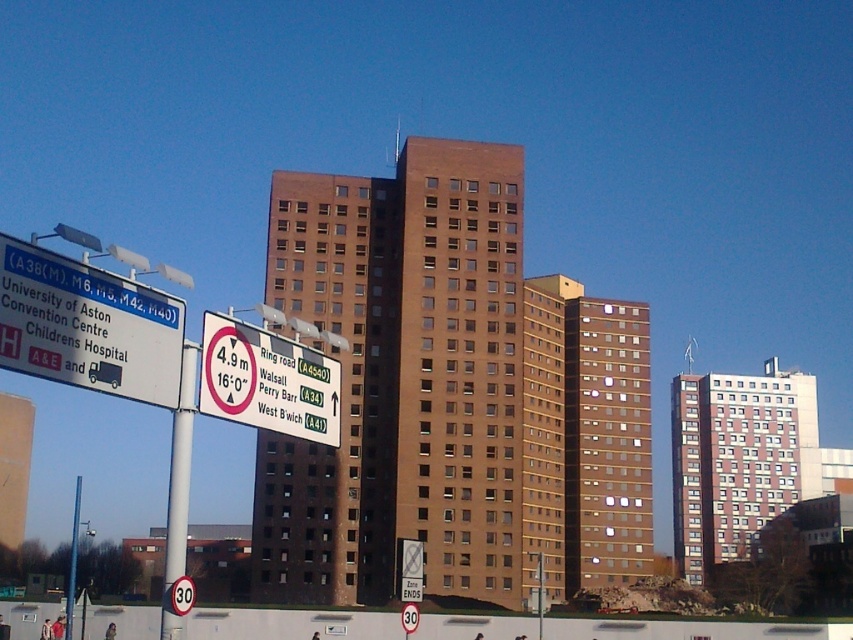
Does point (180, 433) lie in front of point (70, 616)?

Yes, point (180, 433) is closer to viewer.

Looking at this image, can you confirm if white plastic pole at left is smaller than metallic pole at left?

Yes.

Does point (177, 472) come closer to viewer compared to point (70, 611)?

Yes, it is in front of point (70, 611).

You are a GUI agent. You are given a task and a screenshot of the screen. Output one action in this format:
    pyautogui.click(x=<x>, y=<y>)
    Task: Click on the white plastic pole at left
    
    Given the screenshot: What is the action you would take?
    pyautogui.click(x=178, y=490)

Consider the image. Can you confirm if white plastic sign at upper center is positioned to the right of white plastic pole at left?

Correct, you'll find white plastic sign at upper center to the right of white plastic pole at left.

How far apart are white plastic sign at upper center and white plastic pole at left?

white plastic sign at upper center is 16.17 feet from white plastic pole at left.

Who is more distant from viewer, (244, 387) or (167, 481)?

Point (167, 481)

The height and width of the screenshot is (640, 853). In order to click on white plastic sign at upper center in this screenshot , I will do `click(267, 381)`.

Can you confirm if white plastic sign at upper center is smaller than metallic pole at left?

Correct, white plastic sign at upper center occupies less space than metallic pole at left.

The height and width of the screenshot is (640, 853). Find the location of `white plastic sign at upper center`. white plastic sign at upper center is located at coordinates (267, 381).

Measure the distance between white plastic sign at upper center and camera.

76.12 feet

You are a GUI agent. You are given a task and a screenshot of the screen. Output one action in this format:
    pyautogui.click(x=<x>, y=<y>)
    Task: Click on the white plastic sign at upper center
    The width and height of the screenshot is (853, 640).
    Given the screenshot: What is the action you would take?
    pyautogui.click(x=267, y=381)